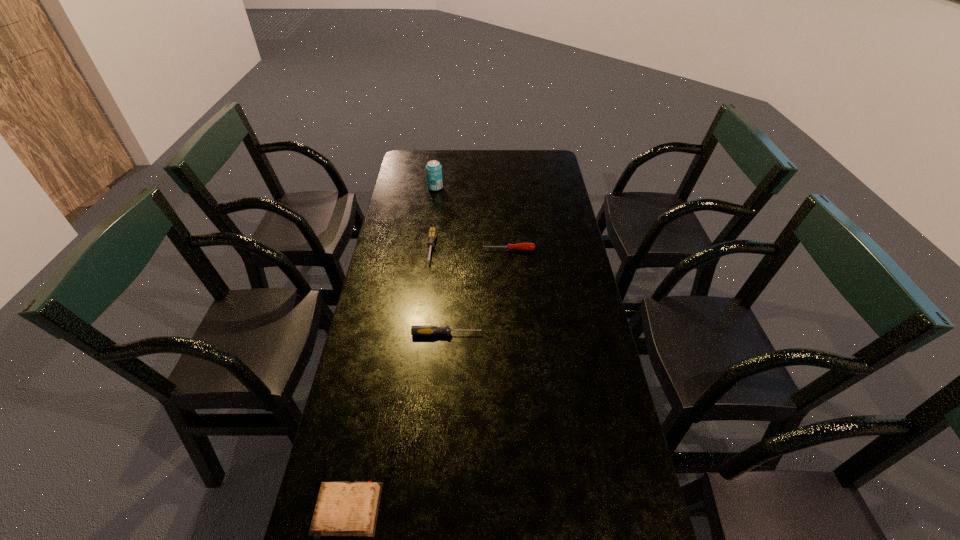
Where is `vacant region at the far left corner of the desktop`? This screenshot has width=960, height=540. vacant region at the far left corner of the desktop is located at coordinates (423, 150).

Choose which object is the third nearest neighbor to the tallest object. Please provide its 2D coordinates. Your answer should be formatted as a tuple, i.e. [(x, y)], where the tuple contains the x and y coordinates of a point satisfying the conditions above.

[(415, 330)]

Identify which object is located as the third nearest to the farthest object. Please provide its 2D coordinates. Your answer should be formatted as a tuple, i.e. [(x, y)], where the tuple contains the x and y coordinates of a point satisfying the conditions above.

[(415, 330)]

You are a GUI agent. You are given a task and a screenshot of the screen. Output one action in this format:
    pyautogui.click(x=<x>, y=<y>)
    Task: Click on the closest screwdriver to the diary
    This screenshot has height=540, width=960.
    Given the screenshot: What is the action you would take?
    pyautogui.click(x=415, y=330)

Find the location of a particular element. The image size is (960, 540). screwdriver that is the closest to the beer can is located at coordinates (432, 234).